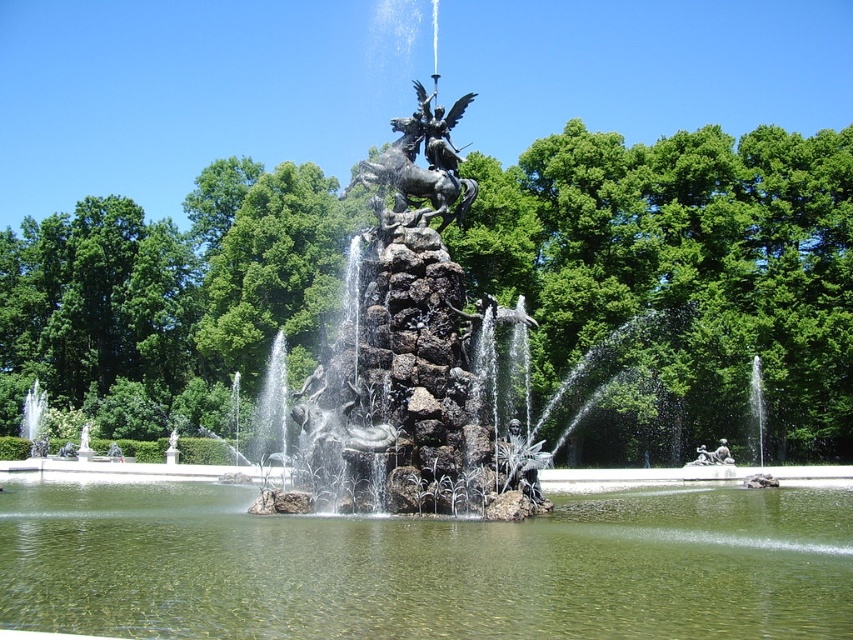
You are a landscape architect designing a new park. You want to place a new bench between the green stone lake at center and the polished bronze statue at upper center. Which side of the bench should face the wider object to ensure visitors can view it comfortably?

The green stone lake at center is wider than the polished bronze statue at upper center. Therefore, the bench should be positioned so that its front faces the green stone lake at center to allow visitors to comfortably view the wider object.

You are standing at the entrance of the park and want to locate the green stone lake at center. According to the coordinates provided, in which direction should you walk to reach it?

The green stone lake at center is located at coordinates point (426,566). Since the x coordinate is 0.886, which is closer to 1, you should walk towards the right side to reach it.

Consider the image. You are standing in the park and want to take a photo of the polished bronze statue at upper center without the green stone lake at center appearing in the frame. Is this possible given their positions?

The green stone lake at center is located below the polished bronze statue at upper center, so if you position yourself to frame the statue while avoiding looking downward, you can exclude the lake from the photo.